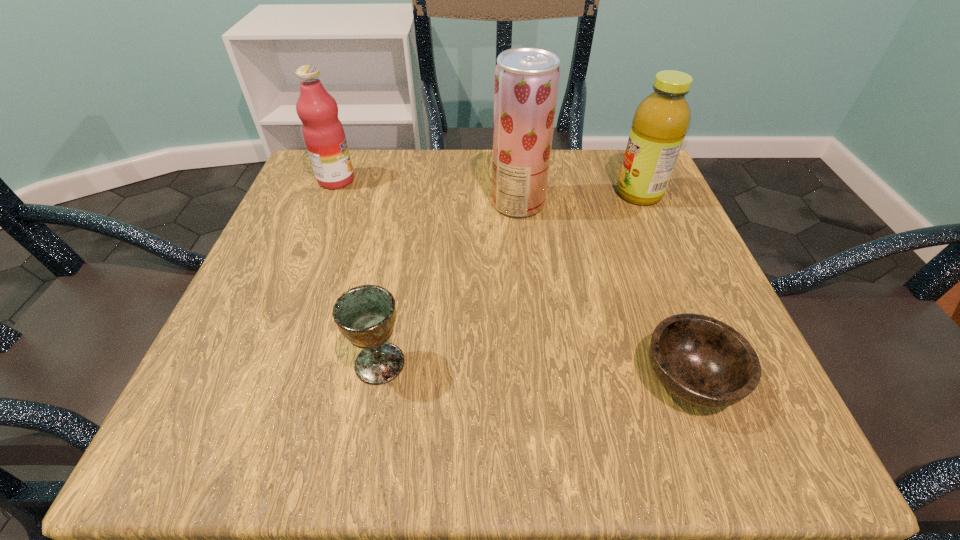
I want to click on free spot between the tallest object and the fourth object from right to left, so point(449,283).

The width and height of the screenshot is (960, 540). What are the coordinates of `free space between the bowl and the fourth object from right to left` in the screenshot? It's located at (535, 371).

Locate an element on the screen. The height and width of the screenshot is (540, 960). free space between the rightmost fruit juice and the third object from right to left is located at coordinates (x=579, y=198).

Where is `empty space between the rightmost fruit juice and the chalice`? empty space between the rightmost fruit juice and the chalice is located at coordinates (x=510, y=279).

Where is `free spot between the tallest object and the rightmost fruit juice`? The width and height of the screenshot is (960, 540). free spot between the tallest object and the rightmost fruit juice is located at coordinates point(579,198).

At what (x,y) coordinates should I click in order to perform the action: click on free space between the rightmost fruit juice and the fourth tallest object. Please return your answer as a coordinate pair (x, y). This screenshot has height=540, width=960. Looking at the image, I should click on (510, 279).

At what (x,y) coordinates should I click in order to perform the action: click on unoccupied area between the rightmost fruit juice and the leftmost fruit juice. Please return your answer as a coordinate pair (x, y). Looking at the image, I should click on point(488,187).

You are a GUI agent. You are given a task and a screenshot of the screen. Output one action in this format:
    pyautogui.click(x=<x>, y=<y>)
    Task: Click on the free area in between the fourth tallest object and the shortest object
    The width and height of the screenshot is (960, 540).
    Given the screenshot: What is the action you would take?
    pyautogui.click(x=535, y=371)

Where is `the second closest object to the fourth object from right to left`? The image size is (960, 540). the second closest object to the fourth object from right to left is located at coordinates click(x=703, y=361).

Where is `object that can be found as the second closest to the leftmost fruit juice`? The image size is (960, 540). object that can be found as the second closest to the leftmost fruit juice is located at coordinates (365, 315).